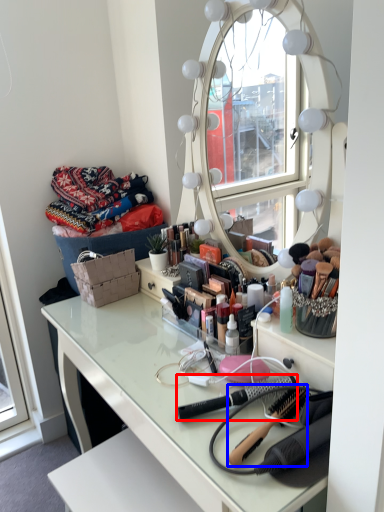
Question: Among these objects, which one is nearest to the camera, brush (highlighted by a red box) or brush (highlighted by a blue box)?

Choices:
 (A) brush
 (B) brush

Answer: (B)